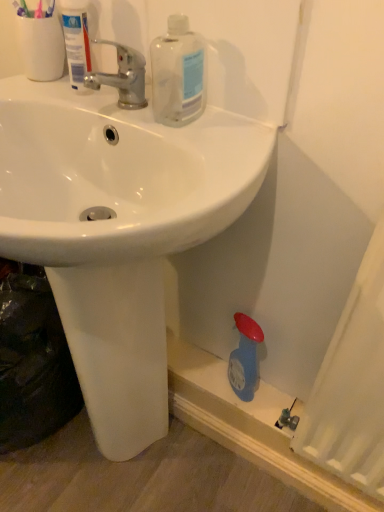
The height and width of the screenshot is (512, 384). Describe the element at coordinates (76, 41) in the screenshot. I see `white plastic tube at upper left` at that location.

The width and height of the screenshot is (384, 512). What are the coordinates of `chrome metallic faucet at upper center` in the screenshot? It's located at (123, 77).

Can white plastic tube at upper left be found inside chrome metallic faucet at upper center?

Definitely not — white plastic tube at upper left is not inside chrome metallic faucet at upper center.

Is point (127, 105) positioned after point (67, 35)?

That is False.

Is chrome metallic faucet at upper center turned away from white plastic tube at upper left?

No, white plastic tube at upper left is not at the back of chrome metallic faucet at upper center.

How far apart are chrome metallic faucet at upper center and white plastic tube at upper left?

The distance of chrome metallic faucet at upper center from white plastic tube at upper left is 2.23 inches.

Between transparent plastic bottle at upper center and chrome metallic faucet at upper center, which one appears on the right side from the viewer's perspective?

transparent plastic bottle at upper center.

Considering their positions, is transparent plastic bottle at upper center located in front of or behind chrome metallic faucet at upper center?

transparent plastic bottle at upper center is positioned closer to the viewer than chrome metallic faucet at upper center.

Could you tell me if transparent plastic bottle at upper center is facing chrome metallic faucet at upper center?

No, transparent plastic bottle at upper center is not facing towards chrome metallic faucet at upper center.

At what (x,y) coordinates should I click in order to perform the action: click on cleaning product above the chrome metallic faucet at upper center (from the image's perspective). Please return your answer as a coordinate pair (x, y). The width and height of the screenshot is (384, 512). Looking at the image, I should click on (178, 74).

Looking at this image, which of these two, white plastic tube at upper left or transparent plastic bottle at upper center, is smaller?

white plastic tube at upper left is smaller.

Is white plastic tube at upper left oriented towards transparent plastic bottle at upper center?

No, white plastic tube at upper left is not aimed at transparent plastic bottle at upper center.

From a real-world perspective, who is located higher, white plastic tube at upper left or transparent plastic bottle at upper center?

In real-world perspective, white plastic tube at upper left is above.

How distant is white plastic tube at upper left from transparent plastic bottle at upper center?

white plastic tube at upper left is 6.03 inches away from transparent plastic bottle at upper center.

Considering the relative sizes of white glossy sink at center and chrome metallic faucet at upper center in the image provided, is white glossy sink at center smaller than chrome metallic faucet at upper center?

No, white glossy sink at center is not smaller than chrome metallic faucet at upper center.

Is point (88, 194) less distant than point (146, 105)?

That is False.

Is white glossy sink at center positioned far away from chrome metallic faucet at upper center?

white glossy sink at center is actually quite close to chrome metallic faucet at upper center.

Find the location of a particular element. This screenshot has width=384, height=512. tap lying behind the white glossy sink at center is located at coordinates (123, 77).

Measure the distance between chrome metallic faucet at upper center and white glossy sink at center.

12.19 inches.

From a real-world perspective, is chrome metallic faucet at upper center above or below white glossy sink at center?

chrome metallic faucet at upper center is situated higher than white glossy sink at center in the real world.

Based on their sizes in the image, would you say chrome metallic faucet at upper center is bigger or smaller than white glossy sink at center?

Clearly, chrome metallic faucet at upper center is smaller in size than white glossy sink at center.

Consider the image. Is chrome metallic faucet at upper center inside the boundaries of white glossy sink at center, or outside?

chrome metallic faucet at upper center is located beyond the bounds of white glossy sink at center.

From the image's perspective, is transparent plastic bottle at upper center over white glossy sink at center?

Indeed, from the image's perspective, transparent plastic bottle at upper center is shown above white glossy sink at center.

Is the position of transparent plastic bottle at upper center more distant than that of white glossy sink at center?

Yes, transparent plastic bottle at upper center is further from the viewer.

Can you confirm if transparent plastic bottle at upper center is thinner than white glossy sink at center?

Yes, transparent plastic bottle at upper center is thinner than white glossy sink at center.

Where is `sink in front of the transparent plastic bottle at upper center`? sink in front of the transparent plastic bottle at upper center is located at coordinates coord(117,230).

How different are the orientations of white glossy sink at center and transparent plastic bottle at upper center in degrees?

They differ by 0.00206 degrees in their facing directions.

Is white glossy sink at center with transparent plastic bottle at upper center?

white glossy sink at center is not next to transparent plastic bottle at upper center, and they're not touching.

Considering the relative sizes of white glossy sink at center and transparent plastic bottle at upper center in the image provided, is white glossy sink at center bigger than transparent plastic bottle at upper center?

Yes, white glossy sink at center is bigger than transparent plastic bottle at upper center.

From the image's perspective, is white glossy sink at center on transparent plastic bottle at upper center?

Incorrect, from the image's perspective, white glossy sink at center is lower than transparent plastic bottle at upper center.

Where is `tap that is on the right side of white plastic tube at upper left`? The width and height of the screenshot is (384, 512). tap that is on the right side of white plastic tube at upper left is located at coordinates (x=123, y=77).

At what (x,y) coordinates should I click in order to perform the action: click on tap beneath the transparent plastic bottle at upper center (from a real-world perspective). Please return your answer as a coordinate pair (x, y). This screenshot has height=512, width=384. Looking at the image, I should click on (123, 77).

Looking at the image, which one is located further to chrome metallic faucet at upper center, transparent plastic bottle at upper center or white plastic tube at upper left?

Based on the image, transparent plastic bottle at upper center appears to be further to chrome metallic faucet at upper center.

When comparing their distances from chrome metallic faucet at upper center, does white plastic tube at upper left or transparent plastic bottle at upper center seem further?

Among the two, transparent plastic bottle at upper center is located further to chrome metallic faucet at upper center.

Based on their spatial positions, is white glossy sink at center or chrome metallic faucet at upper center further from transparent plastic bottle at upper center?

white glossy sink at center.

Considering their positions, is white glossy sink at center positioned further to chrome metallic faucet at upper center than transparent plastic bottle at upper center?

The object further to chrome metallic faucet at upper center is white glossy sink at center.

Based on their spatial positions, is white glossy sink at center or white plastic tube at upper left closer to transparent plastic bottle at upper center?

Based on the image, white plastic tube at upper left appears to be nearer to transparent plastic bottle at upper center.

Which object lies nearer to the anchor point white glossy sink at center, transparent plastic bottle at upper center or white plastic tube at upper left?

transparent plastic bottle at upper center is closer to white glossy sink at center.

Considering their positions, is white glossy sink at center positioned closer to white plastic tube at upper left than chrome metallic faucet at upper center?

The object closer to white plastic tube at upper left is chrome metallic faucet at upper center.

When comparing their distances from white plastic tube at upper left, does chrome metallic faucet at upper center or transparent plastic bottle at upper center seem closer?

chrome metallic faucet at upper center.

I want to click on tap situated between white plastic tube at upper left and transparent plastic bottle at upper center from left to right, so click(x=123, y=77).

Where is `tap that lies between white plastic tube at upper left and white glossy sink at center from top to bottom`? This screenshot has width=384, height=512. tap that lies between white plastic tube at upper left and white glossy sink at center from top to bottom is located at coordinates (123, 77).

At what (x,y) coordinates should I click in order to perform the action: click on tap that lies between transparent plastic bottle at upper center and white glossy sink at center from top to bottom. Please return your answer as a coordinate pair (x, y). The height and width of the screenshot is (512, 384). Looking at the image, I should click on (123, 77).

Image resolution: width=384 pixels, height=512 pixels. I want to click on cleaning product between white plastic tube at upper left and white glossy sink at center in the vertical direction, so click(x=178, y=74).